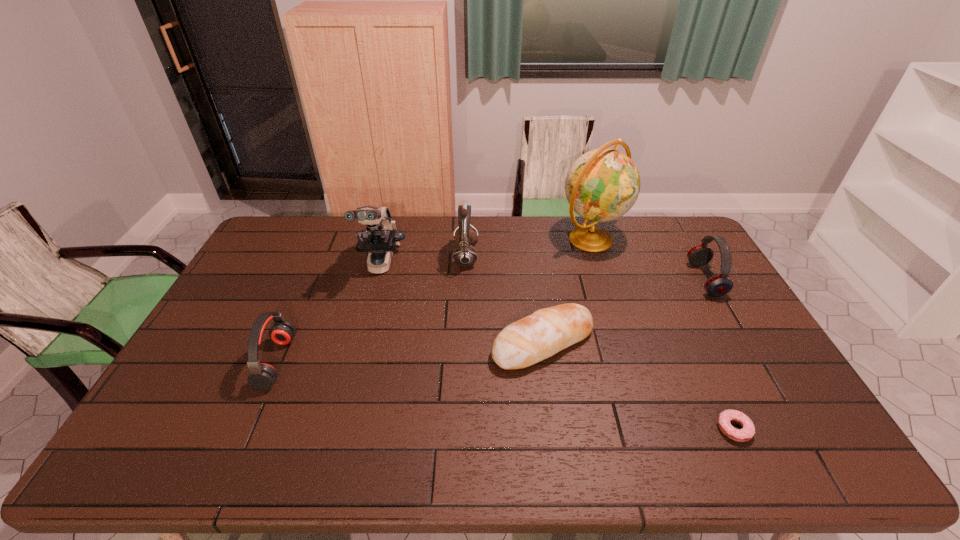
You are a GUI agent. You are given a task and a screenshot of the screen. Output one action in this format:
    pyautogui.click(x=<x>, y=<y>)
    Task: Click on the tallest object
    This screenshot has width=960, height=540.
    Given the screenshot: What is the action you would take?
    pyautogui.click(x=603, y=184)

Where is `the second tallest object`? The image size is (960, 540). the second tallest object is located at coordinates (379, 240).

Identify the location of the second object from left to right. (379, 240).

You are a GUI agent. You are given a task and a screenshot of the screen. Output one action in this format:
    pyautogui.click(x=<x>, y=<y>)
    Task: Click on the third object from left to right
    This screenshot has height=540, width=960.
    Given the screenshot: What is the action you would take?
    pyautogui.click(x=465, y=255)

The height and width of the screenshot is (540, 960). Identify the location of the second earphone from left to right. (465, 255).

At what (x,y) coordinates should I click in order to perform the action: click on the rightmost earphone. Please return your answer as a coordinate pair (x, y). The height and width of the screenshot is (540, 960). Looking at the image, I should click on (718, 285).

What are the coordinates of `the nearest earphone` in the screenshot? It's located at (262, 376).

This screenshot has height=540, width=960. I want to click on the leftmost earphone, so (x=262, y=376).

Locate an element on the screen. bread is located at coordinates pyautogui.click(x=547, y=331).

What are the coordinates of `the shortest object` in the screenshot? It's located at (745, 434).